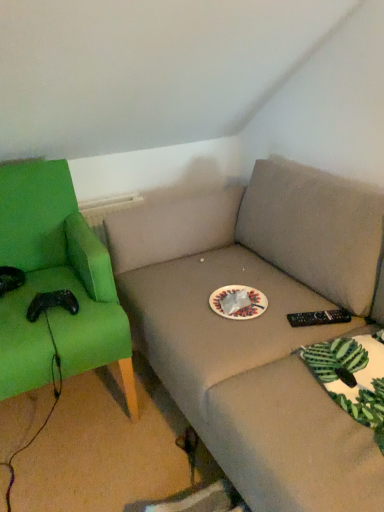
Question: Does point (99, 352) appear closer or farther from the camera than point (226, 309)?

Choices:
 (A) closer
 (B) farther

Answer: (A)

Question: Is green fabric chair at left to the left or to the right of white paper plate at center in the image?

Choices:
 (A) left
 (B) right

Answer: (A)

Question: Do you think green fabric chair at left is within white paper plate at center, or outside of it?

Choices:
 (A) inside
 (B) outside

Answer: (B)

Question: Relative to green fabric chair at left, is white paper plate at center in front or behind?

Choices:
 (A) front
 (B) behind

Answer: (B)

Question: Based on their sizes in the image, would you say white paper plate at center is bigger or smaller than green fabric chair at left?

Choices:
 (A) big
 (B) small

Answer: (B)

Question: In terms of height, does white paper plate at center look taller or shorter compared to green fabric chair at left?

Choices:
 (A) tall
 (B) short

Answer: (B)

Question: Considering the positions of point (221, 304) and point (91, 290), is point (221, 304) closer or farther from the camera than point (91, 290)?

Choices:
 (A) farther
 (B) closer

Answer: (B)